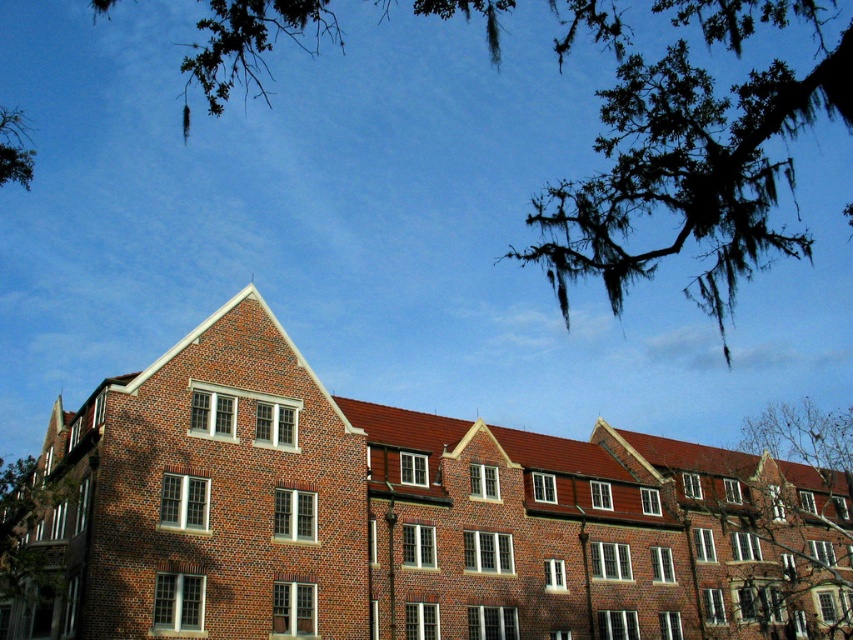
Does green mossy branch at upper right have a greater height compared to green mossy branch at upper left?

In fact, green mossy branch at upper right may be shorter than green mossy branch at upper left.

Between point (766, 541) and point (10, 129), which one is positioned in front?

Point (766, 541) is more forward.

This screenshot has width=853, height=640. Identify the location of green mossy branch at upper right. point(785,515).

Measure the distance from red brick building at center to green mossy branch at upper left.

red brick building at center is 54.65 meters from green mossy branch at upper left.

Is red brick building at center thinner than green mossy branch at upper left?

Indeed, red brick building at center has a lesser width compared to green mossy branch at upper left.

Find the location of a particular element. This screenshot has width=853, height=640. red brick building at center is located at coordinates (413, 515).

Locate an element on the screen. This screenshot has width=853, height=640. red brick building at center is located at coordinates pyautogui.click(x=413, y=515).

Does green mossy branches at upper center appear on the left side of green mossy branch at upper right?

Correct, you'll find green mossy branches at upper center to the left of green mossy branch at upper right.

Where is `green mossy branches at upper center`? This screenshot has width=853, height=640. green mossy branches at upper center is located at coordinates (688, 150).

You are a GUI agent. You are given a task and a screenshot of the screen. Output one action in this format:
    pyautogui.click(x=<x>, y=<y>)
    Task: Click on the green mossy branches at upper center
    Image resolution: width=853 pixels, height=640 pixels.
    Given the screenshot: What is the action you would take?
    pyautogui.click(x=688, y=150)

The image size is (853, 640). Identify the location of green mossy branches at upper center. (688, 150).